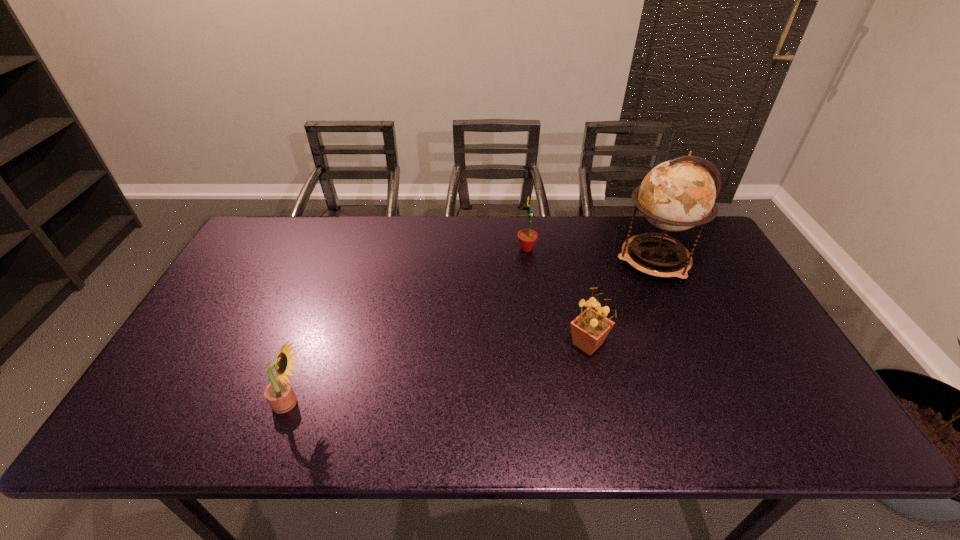
Locate an element on the screen. This screenshot has height=540, width=960. blank area in the image that satisfies the following two spatial constraints: 1. at the center of the rightmost object; 2. at the front of the third farthest object with flowers visible is located at coordinates (691, 344).

What are the coordinates of `vacant space that satisfies the following two spatial constraints: 1. at the front of the second farthest sunflower with flowers visible; 2. on the face of the leftmost sunflower` in the screenshot? It's located at (601, 403).